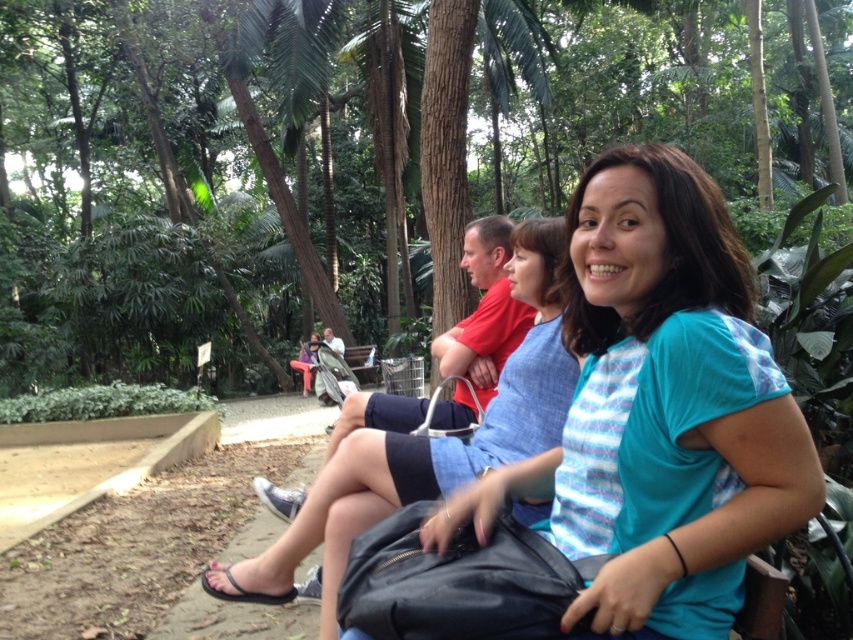
Question: Does green leafy tree at center have a lesser width compared to matte blue shirt at center?

Choices:
 (A) no
 (B) yes

Answer: (A)

Question: Can you confirm if green leafy tree at center is positioned to the right of matte blue shirt at center?

Choices:
 (A) no
 (B) yes

Answer: (A)

Question: Among these objects, which one is farthest from the camera?

Choices:
 (A) green leafy tree at center
 (B) matte blue shirt at center

Answer: (A)

Question: Does green leafy tree at center have a lesser width compared to matte blue shirt at center?

Choices:
 (A) no
 (B) yes

Answer: (A)